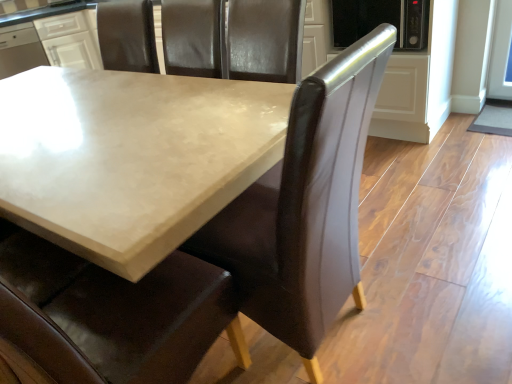
Question: Can you confirm if white glossy cabinet at upper left is positioned to the left of matte concrete table at center?

Choices:
 (A) yes
 (B) no

Answer: (A)

Question: Does white glossy cabinet at upper left lie in front of matte concrete table at center?

Choices:
 (A) no
 (B) yes

Answer: (A)

Question: Is the depth of white glossy cabinet at upper left greater than that of matte concrete table at center?

Choices:
 (A) no
 (B) yes

Answer: (B)

Question: From a real-world perspective, is white glossy cabinet at upper left under matte concrete table at center?

Choices:
 (A) yes
 (B) no

Answer: (B)

Question: Would you say white glossy cabinet at upper left is a long distance from matte concrete table at center?

Choices:
 (A) no
 (B) yes

Answer: (B)

Question: Considering the positions of brown leather chair at center and white glossy cabinet at upper left in the image, is brown leather chair at center wider or thinner than white glossy cabinet at upper left?

Choices:
 (A) wide
 (B) thin

Answer: (B)

Question: From the image's perspective, is brown leather chair at center above or below white glossy cabinet at upper left?

Choices:
 (A) below
 (B) above

Answer: (A)

Question: Considering the positions of point (295, 205) and point (96, 49), is point (295, 205) closer or farther from the camera than point (96, 49)?

Choices:
 (A) farther
 (B) closer

Answer: (B)

Question: Is brown leather chair at center situated inside white glossy cabinet at upper left or outside?

Choices:
 (A) inside
 (B) outside

Answer: (B)

Question: Does point (324, 236) appear closer or farther from the camera than point (33, 190)?

Choices:
 (A) closer
 (B) farther

Answer: (A)

Question: From the image's perspective, relative to matte concrete table at center, is brown leather chair at center above or below?

Choices:
 (A) above
 (B) below

Answer: (A)

Question: Is brown leather chair at center to the left or to the right of matte concrete table at center in the image?

Choices:
 (A) right
 (B) left

Answer: (A)

Question: Based on their sizes in the image, would you say brown leather chair at center is bigger or smaller than matte concrete table at center?

Choices:
 (A) big
 (B) small

Answer: (A)

Question: In terms of size, does white glossy cabinet at upper left appear bigger or smaller than brown leather chair at center?

Choices:
 (A) big
 (B) small

Answer: (B)

Question: From the image's perspective, is white glossy cabinet at upper left above or below brown leather chair at center?

Choices:
 (A) below
 (B) above

Answer: (B)